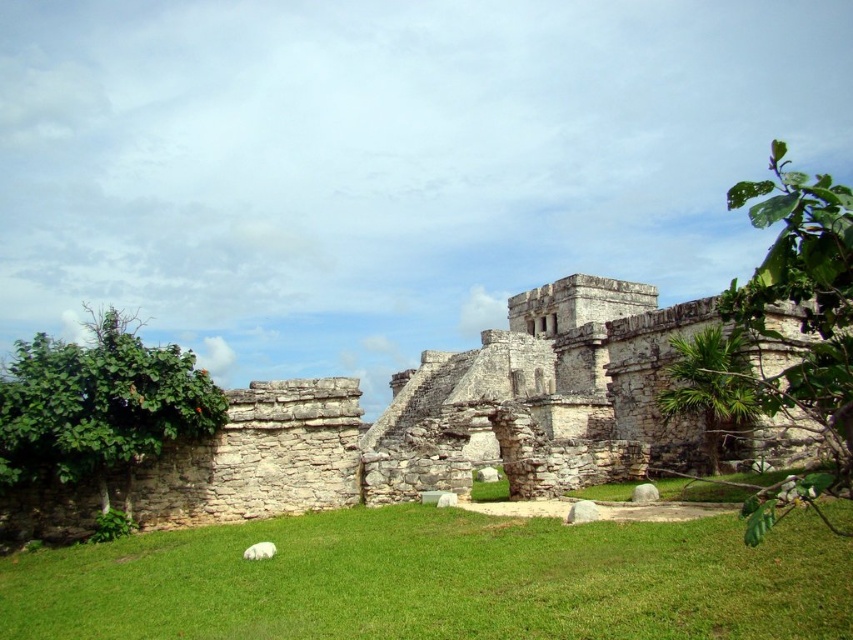
Is green grass at center to the right of stone ruins at center from the viewer's perspective?

Incorrect, green grass at center is not on the right side of stone ruins at center.

Which of these two, green grass at center or stone ruins at center, stands taller?

With more height is stone ruins at center.

Who is more distant from viewer, (422, 544) or (527, 324)?

The point (527, 324) is behind.

The image size is (853, 640). I want to click on green grass at center, so click(x=438, y=580).

Is green grass at center to the left of white fluffy dog at lower left from the viewer's perspective?

No, green grass at center is not to the left of white fluffy dog at lower left.

Consider the image. Is green grass at center above white fluffy dog at lower left?

Yes, green grass at center is above white fluffy dog at lower left.

Which is in front, point (350, 608) or point (254, 544)?

Point (350, 608) is in front.

I want to click on green grass at center, so click(438, 580).

Consider the image. Who is positioned more to the right, stone ruins at center or white fluffy dog at lower left?

Positioned to the right is stone ruins at center.

Does stone ruins at center have a lesser width compared to white fluffy dog at lower left?

No, stone ruins at center is not thinner than white fluffy dog at lower left.

Identify the location of stone ruins at center. (543, 392).